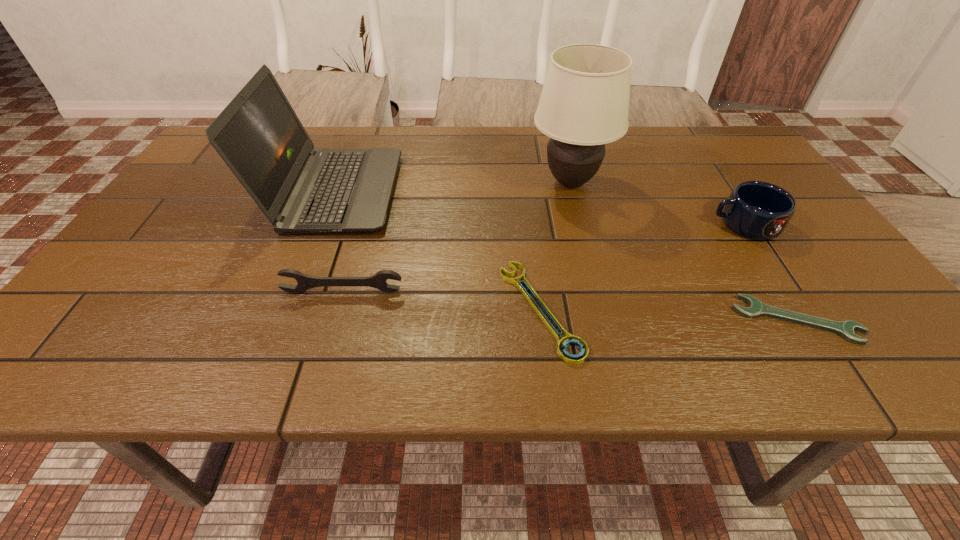
Locate an element on the screen. vacant area that satisfies the following two spatial constraints: 1. with the handle on the side of the mug; 2. on the open ends of the tallest wrench is located at coordinates (789, 292).

Where is `vacant space that satisfies the following two spatial constraints: 1. on the open ends of the second wrench from right to left; 2. on the right side of the tallest wrench`? The height and width of the screenshot is (540, 960). vacant space that satisfies the following two spatial constraints: 1. on the open ends of the second wrench from right to left; 2. on the right side of the tallest wrench is located at coordinates (338, 309).

Locate an element on the screen. free spot that satisfies the following two spatial constraints: 1. on the open ends of the third shortest object; 2. on the left side of the second wrench from right to left is located at coordinates (338, 309).

Find the location of a particular element. This screenshot has height=540, width=960. free space that satisfies the following two spatial constraints: 1. with the handle on the side of the fourth shortest object; 2. on the open ends of the tallest wrench is located at coordinates tap(789, 292).

The height and width of the screenshot is (540, 960). Identify the location of vacant region that satisfies the following two spatial constraints: 1. on the back side of the rightmost wrench; 2. on the screen of the second tallest object. (715, 192).